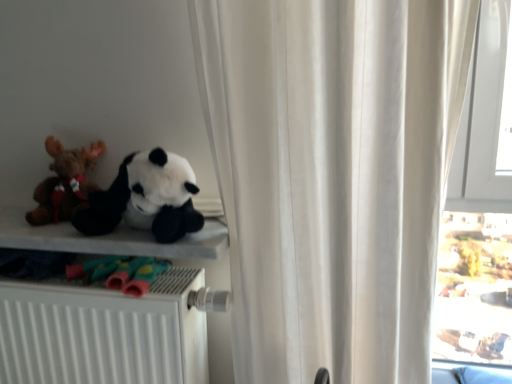
Question: Should I look upward or downward to see transparent glass window at right?

Choices:
 (A) down
 (B) up

Answer: (A)

Question: Is white fabric curtain at upper center completely or partially outside of soft plush panda at left, the second toy viewed from the left?

Choices:
 (A) no
 (B) yes

Answer: (B)

Question: Is white fabric curtain at upper center at the left side of soft plush panda at left, which is the first toy from right to left?

Choices:
 (A) no
 (B) yes

Answer: (A)

Question: Is white fabric curtain at upper center oriented towards soft plush panda at left, which is the first toy from right to left?

Choices:
 (A) no
 (B) yes

Answer: (A)

Question: Is soft plush panda at left, the second toy viewed from the left, located within white fabric curtain at upper center?

Choices:
 (A) yes
 (B) no

Answer: (B)

Question: Is white fabric curtain at upper center taller than soft plush panda at left, the second toy viewed from the left?

Choices:
 (A) no
 (B) yes

Answer: (B)

Question: Is white fabric curtain at upper center wider than soft plush panda at left, the second toy viewed from the left?

Choices:
 (A) yes
 (B) no

Answer: (A)

Question: Is white fabric curtain at upper center positioned behind soft fabric shelf at left?

Choices:
 (A) yes
 (B) no

Answer: (B)

Question: Is white fabric curtain at upper center smaller than soft fabric shelf at left?

Choices:
 (A) no
 (B) yes

Answer: (A)

Question: Can you confirm if white fabric curtain at upper center is shorter than soft fabric shelf at left?

Choices:
 (A) yes
 (B) no

Answer: (B)

Question: Considering the relative sizes of white fabric curtain at upper center and soft fabric shelf at left in the image provided, is white fabric curtain at upper center taller than soft fabric shelf at left?

Choices:
 (A) yes
 (B) no

Answer: (A)

Question: From the image's perspective, is white fabric curtain at upper center on soft fabric shelf at left?

Choices:
 (A) yes
 (B) no

Answer: (A)

Question: Is white fabric curtain at upper center oriented towards soft fabric shelf at left?

Choices:
 (A) no
 (B) yes

Answer: (A)

Question: Considering the relative sizes of soft plush panda at left, the second toy viewed from the left, and white matte radiator at lower left in the image provided, is soft plush panda at left, the second toy viewed from the left, bigger than white matte radiator at lower left?

Choices:
 (A) no
 (B) yes

Answer: (A)